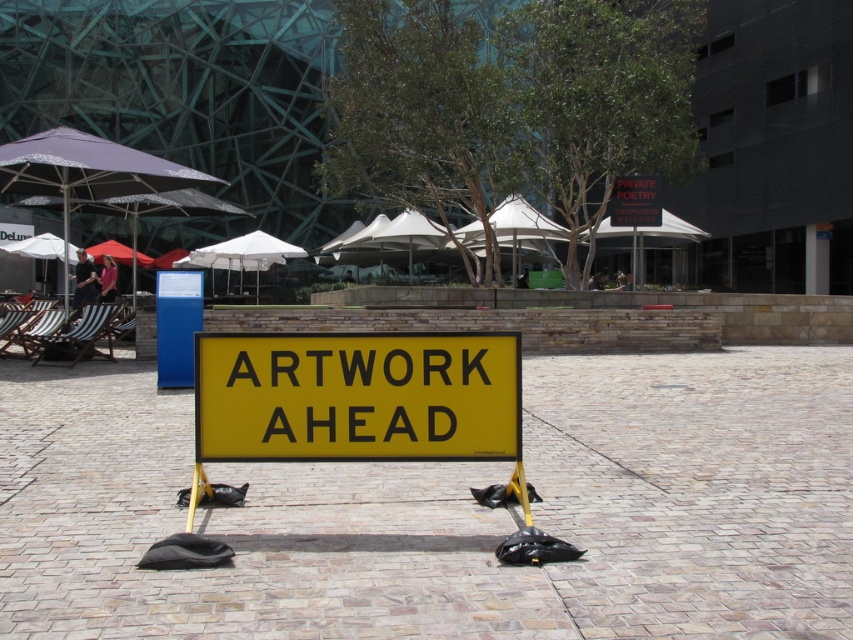
Question: Is yellow/yellowish metal sign at center positioned behind purple fabric umbrella at upper left?

Choices:
 (A) yes
 (B) no

Answer: (B)

Question: Which of the following is the farthest from the observer?

Choices:
 (A) (630, 177)
 (B) (212, 429)

Answer: (A)

Question: Is purple fabric umbrella at upper left above black plastic sign at center?

Choices:
 (A) yes
 (B) no

Answer: (A)

Question: Based on their relative distances, which object is farther from the yellow/yellowish metal sign at center?

Choices:
 (A) black plastic sign at center
 (B) purple fabric umbrella at upper left

Answer: (A)

Question: Does yellow/yellowish metal sign at center have a greater width compared to purple fabric umbrella at upper left?

Choices:
 (A) no
 (B) yes

Answer: (A)

Question: Which object is positioned closest to the yellow/yellowish metal sign at center?

Choices:
 (A) purple fabric umbrella at upper left
 (B) black plastic sign at center

Answer: (A)